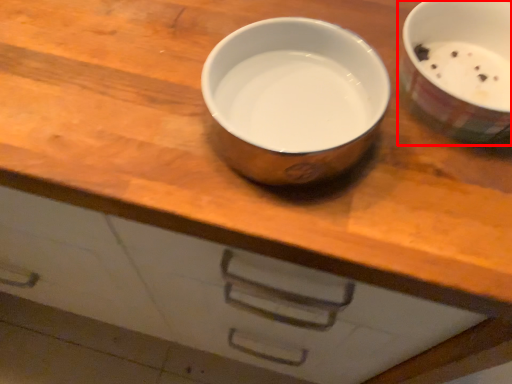
Question: Considering the relative positions of tableware (annotated by the red box) and tableware in the image provided, where is tableware (annotated by the red box) located with respect to the staircase?

Choices:
 (A) left
 (B) right

Answer: (B)